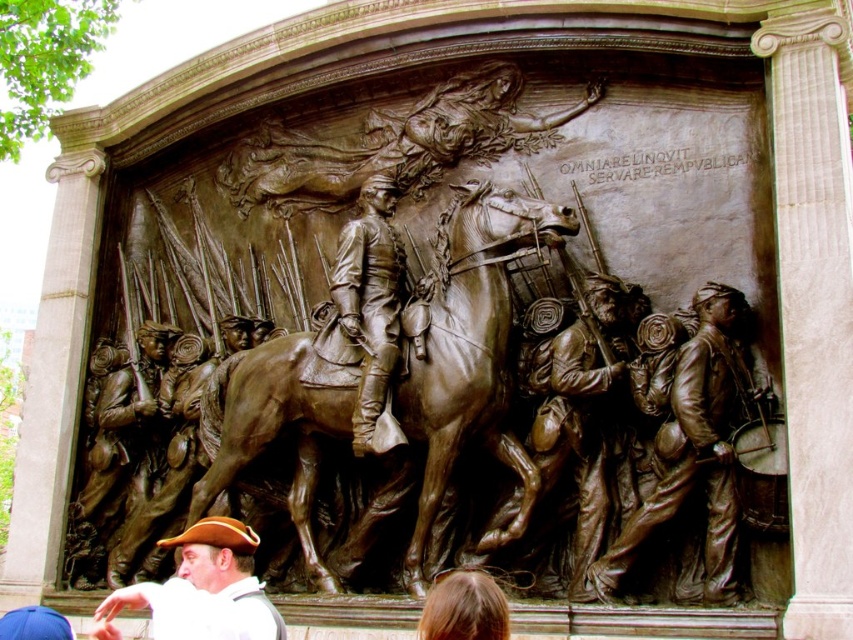
Question: Does bronze sculpture at center appear under matte brown hat at lower left?

Choices:
 (A) no
 (B) yes

Answer: (A)

Question: Can you confirm if bronze sculpture at center is positioned to the left of bronze figure at center?

Choices:
 (A) yes
 (B) no

Answer: (A)

Question: Among these points, which one is nearest to the camera?

Choices:
 (A) (258, 412)
 (B) (480, 605)

Answer: (B)

Question: Among these points, which one is nearest to the camera?

Choices:
 (A) (357, 404)
 (B) (389, 243)
 (C) (242, 620)
 (D) (631, 497)

Answer: (C)

Question: Which is farther from the bronze uniform at center?

Choices:
 (A) bronze figure at center
 (B) bronze sculpture at center
 (C) blonde hair at lower center
 (D) matte brown hat at lower left

Answer: (D)

Question: Is bronze sculpture at center positioned behind bronze figure at center?

Choices:
 (A) no
 (B) yes

Answer: (A)